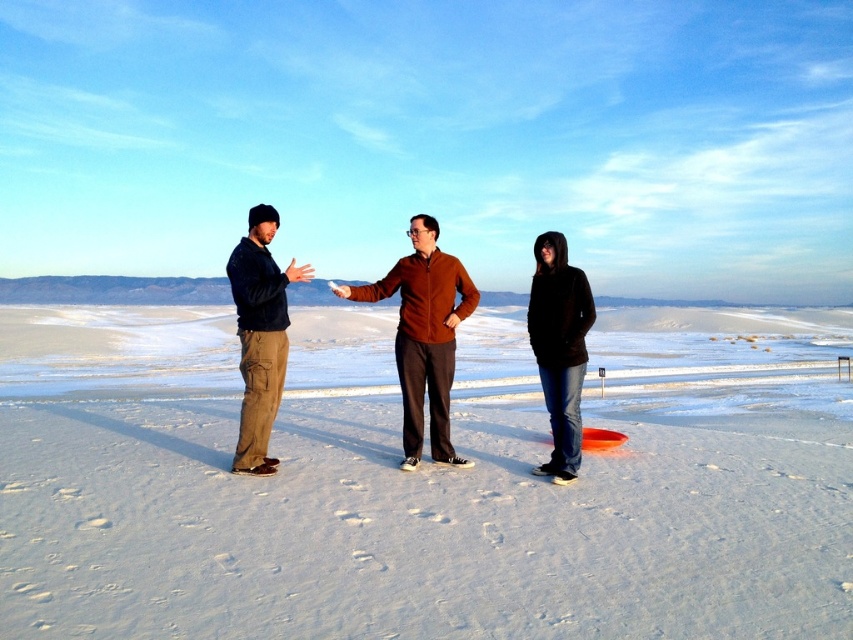
You are an observer standing at the center of the snowfield. You see the matte black jacket at left and the black matte hoodie at lower right. Which of the two is wider from your perspective?

The matte black jacket at left might be wider than the black matte hoodie at lower right according to the description.

You are standing at the edge of the snowy desert and want to walk towards the brown fleece jacket at center and the matte black jacket at left. Which person will you reach first?

You will reach the brown fleece jacket at center first because it is closer to you than the matte black jacket at left.

You are standing at the point labeled point (252, 529) and want to walk to the point labeled point (575, 467). Given that both points are on the snow, which direction should you face to walk directly towards your destination?

You should face away from the viewer because point (252, 529) is closer to the viewer than point (575, 467), so to reach the farther point, you need to walk away from the viewer.